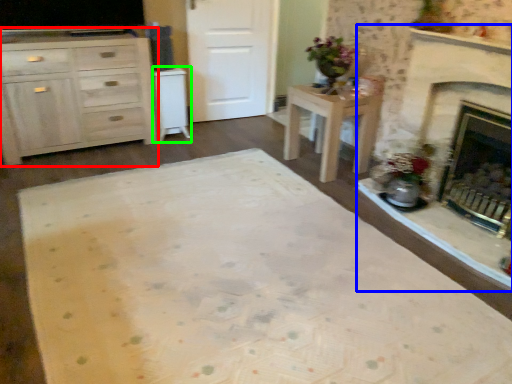
Question: Based on their relative distances, which object is nearer to cabinetry (highlighted by a red box)? Choose from fireplace (highlighted by a blue box) and cabinetry (highlighted by a green box).

Choices:
 (A) fireplace
 (B) cabinetry

Answer: (B)